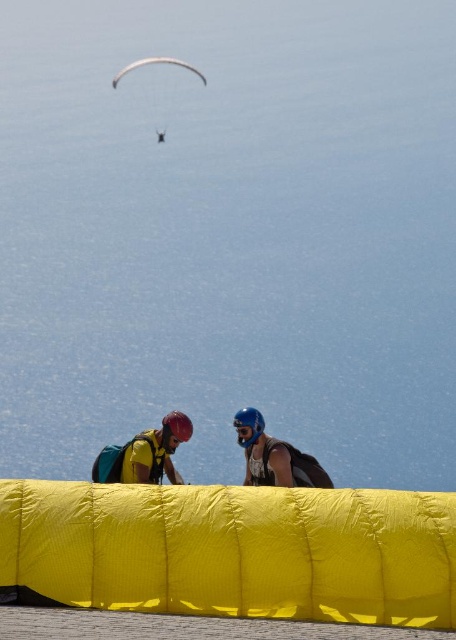
Question: Does blue matte helmet at center appear on the left side of white glossy parachute at upper center?

Choices:
 (A) no
 (B) yes

Answer: (A)

Question: Among these objects, which one is farthest from the camera?

Choices:
 (A) yellow fabric parachute at lower center
 (B) white glossy parachute at upper center
 (C) yellow fabric parachute at center
 (D) blue matte helmet at center

Answer: (B)

Question: Which point is farther from the camera taking this photo?

Choices:
 (A) (198, 582)
 (B) (154, 451)

Answer: (B)

Question: Is blue matte helmet at center in front of yellow fabric parachute at lower center?

Choices:
 (A) yes
 (B) no

Answer: (A)

Question: Where is yellow fabric parachute at lower center located in relation to white glossy parachute at upper center in the image?

Choices:
 (A) right
 (B) left

Answer: (A)

Question: Which of these objects is positioned farthest from the yellow fabric parachute at center?

Choices:
 (A) blue matte helmet at center
 (B) yellow fabric parachute at lower center
 (C) white glossy parachute at upper center

Answer: (C)